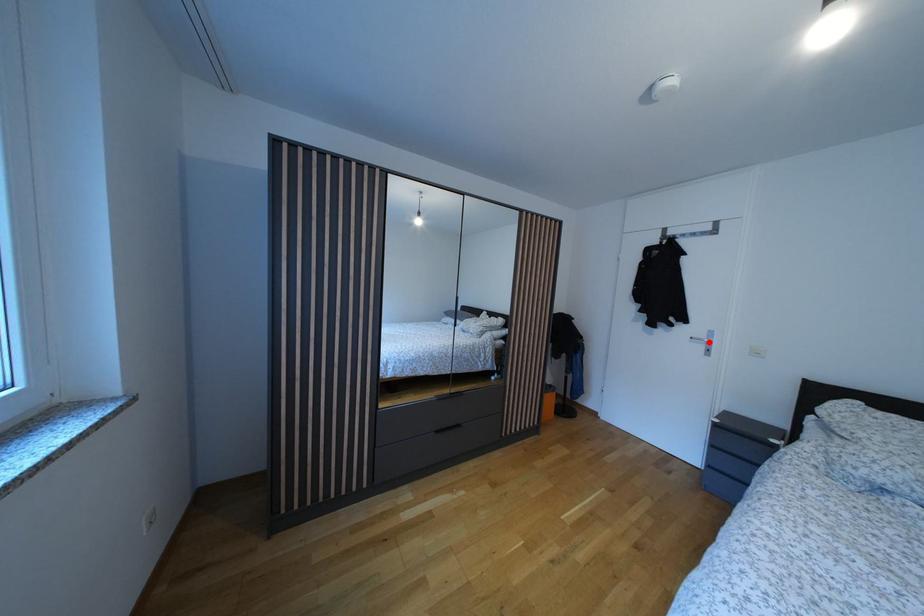
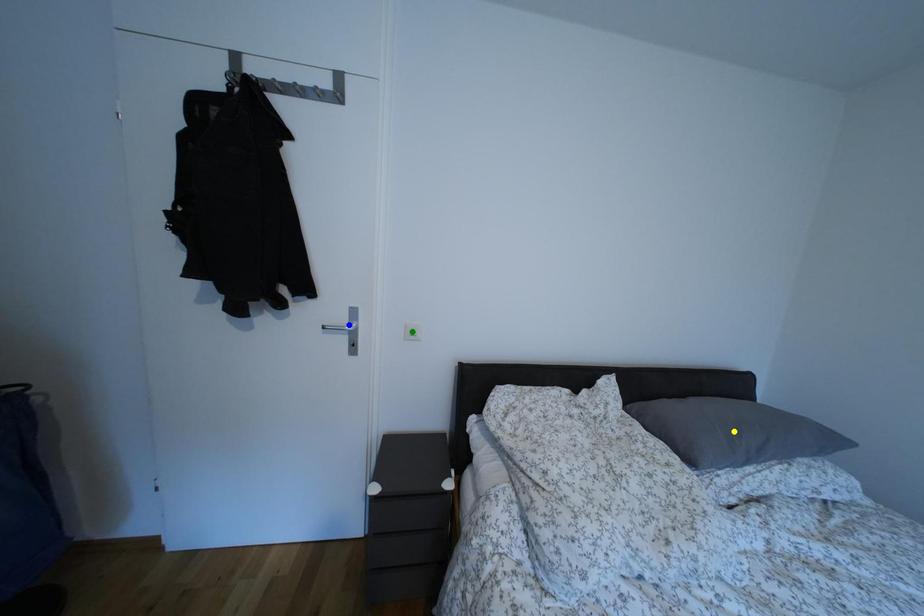
Question: I am providing you with two images of the same scene from different viewpoints. A red point is marked on the first image. You are given multiple points on the second image. Which point in image 2 is actually the same real-world point as the red point in image 1?

Choices:
 (A) blue point
 (B) yellow point
 (C) green point

Answer: (A)